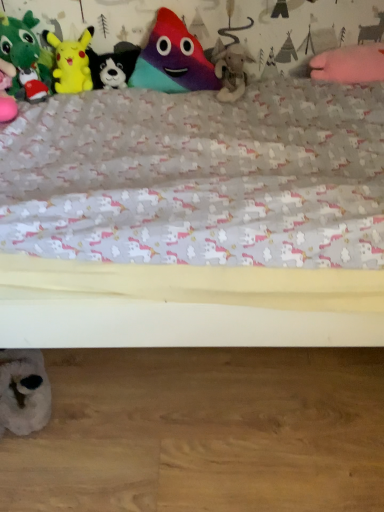
Question: Based on their positions, is black plush dog at upper center, the third toy from the bottom, located to the left or right of fuzzy beige stuffed animal at center, which is the fifth toy from top to bottom?

Choices:
 (A) left
 (B) right

Answer: (A)

Question: Considering the positions of point (119, 83) and point (221, 47), is point (119, 83) closer or farther from the camera than point (221, 47)?

Choices:
 (A) farther
 (B) closer

Answer: (B)

Question: Which of these objects is positioned closest to the green plush toy at left, marked as the third toy in a top-to-bottom arrangement?

Choices:
 (A) yellow plush at upper left, the 5th toy positioned from the bottom
 (B) white plush toy at lower left, which appears as the 1th toy when ordered from the bottom
 (C) fuzzy beige stuffed animal at center, which is the fifth toy from top to bottom
 (D) black plush dog at upper center, the third toy from the bottom
 (E) multicolored plush toy at center, which is the 6th toy from bottom to top

Answer: (A)

Question: Which object is positioned closest to the black plush dog at upper center, positioned as the fourth toy in top-to-bottom order?

Choices:
 (A) multicolored plush toy at center, the 1th toy from the top
 (B) white plush toy at lower left, which appears as the 1th toy when ordered from the bottom
 (C) green plush toy at left, arranged as the fourth toy when ordered from the bottom
 (D) yellow plush at upper left, the 5th toy positioned from the bottom
 (E) fuzzy beige stuffed animal at center, which is the second toy in bottom-to-top order

Answer: (D)